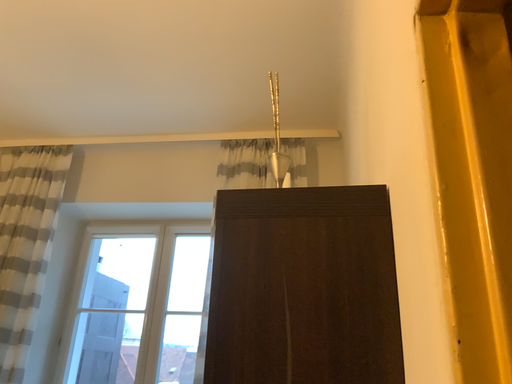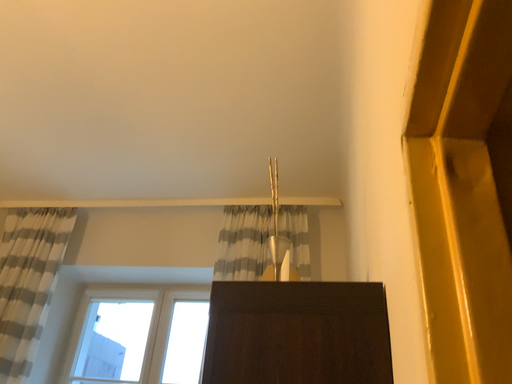
Question: How did the camera likely rotate when shooting the video?

Choices:
 (A) rotated downward
 (B) rotated upward

Answer: (B)